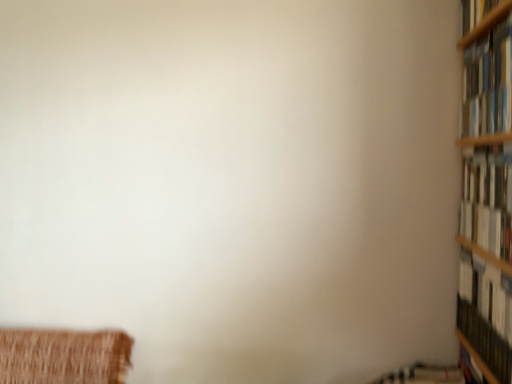
Question: Based on their positions, is hardcover book at right, acting as the first book starting from the bottom, located to the left or right of white paper book at right, the second book from the top?

Choices:
 (A) right
 (B) left

Answer: (A)

Question: From the image's perspective, is hardcover book at right, the third book when ordered from top to bottom, located above or below white paper book at right, the 2th book from the bottom?

Choices:
 (A) above
 (B) below

Answer: (B)

Question: Which is farther from the hardcover book at right, acting as the first book starting from the bottom?

Choices:
 (A) white paper book at right, the 2th book from the bottom
 (B) hardcover books at upper right, the third book positioned from the bottom

Answer: (B)

Question: Based on their relative distances, which object is farther from the hardcover books at upper right, which is counted as the first book, starting from the top?

Choices:
 (A) hardcover book at right, the third book when ordered from top to bottom
 (B) white paper book at right, the second book from the top

Answer: (A)